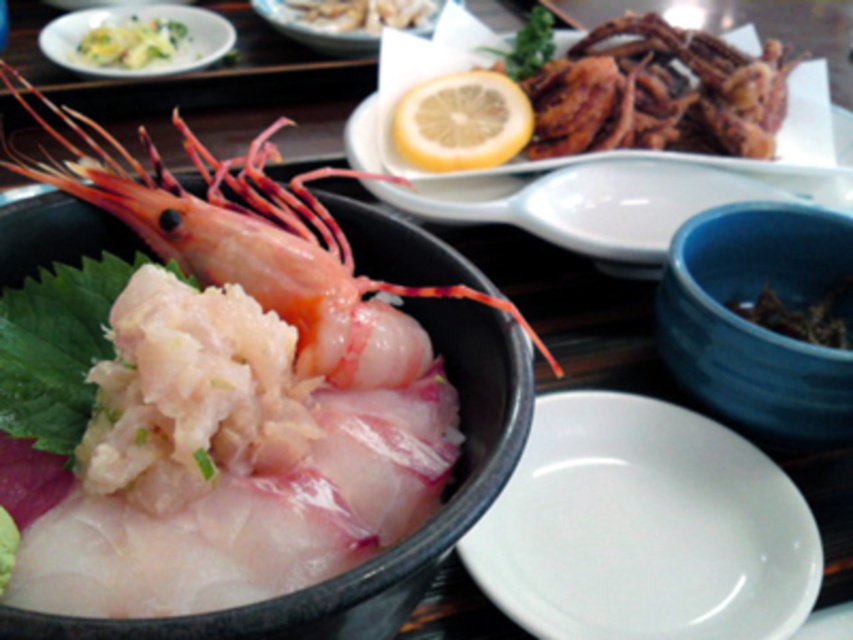
Question: Which object is positioned closest to the matte yellow lemon at upper center?

Choices:
 (A) smooth white plate at upper left
 (B) white creamy sauce at upper center

Answer: (B)

Question: Which of the following is the closest to the observer?

Choices:
 (A) yellow shredded salad at upper left
 (B) brown dried seaweed at upper right
 (C) matte ceramic plate at upper center

Answer: (B)

Question: Can you confirm if matte ceramic plate at upper center is wider than white creamy sauce at upper center?

Choices:
 (A) no
 (B) yes

Answer: (B)

Question: Based on their relative distances, which object is farther from the yellow matte lemon at center?

Choices:
 (A) grilled squid at upper right
 (B) white glossy bowl at center

Answer: (B)

Question: Is white glossy plate at center to the right of blue ceramic bowl at lower right from the viewer's perspective?

Choices:
 (A) yes
 (B) no

Answer: (B)

Question: Can you confirm if pink translucent shrimp at center is wider than yellow shredded salad at upper left?

Choices:
 (A) yes
 (B) no

Answer: (A)